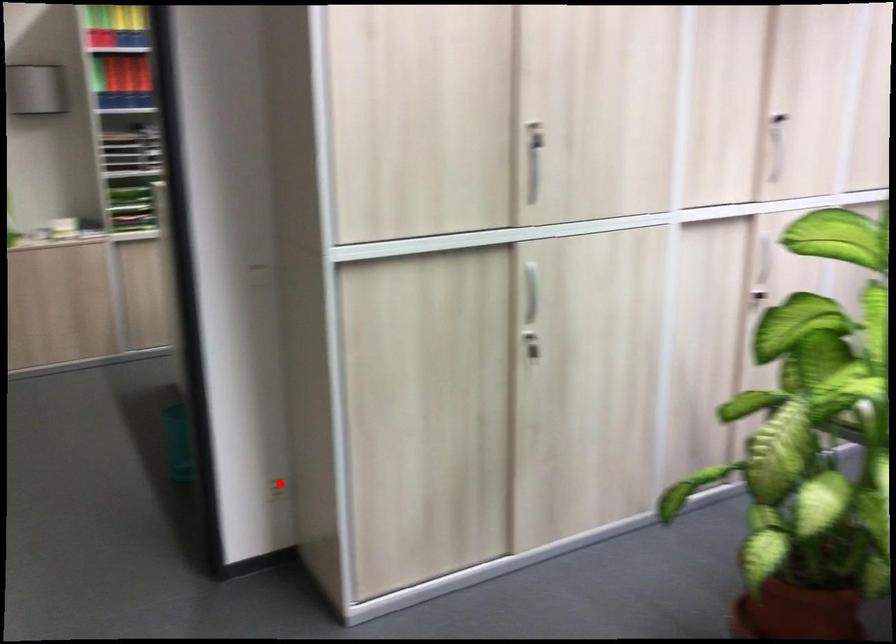
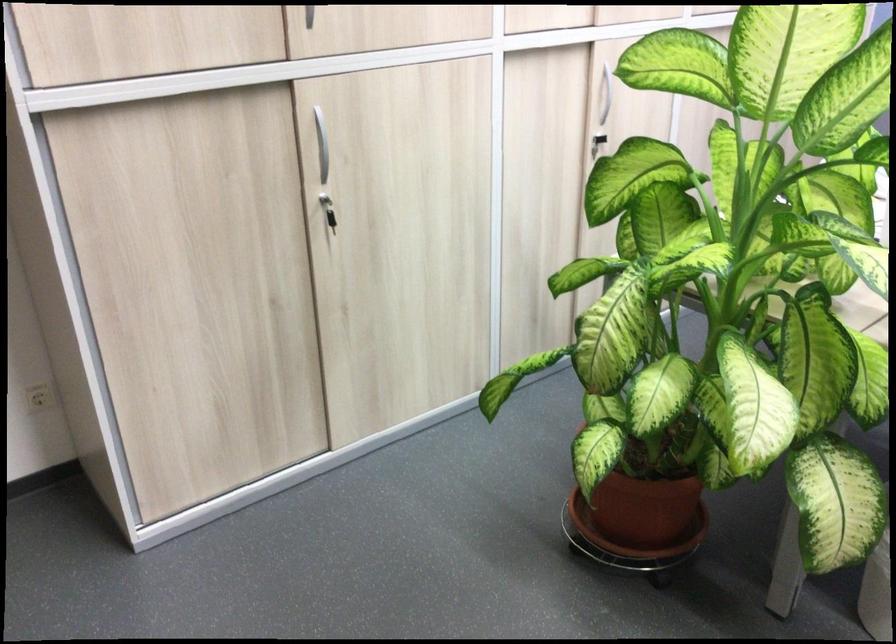
Find the pixel in the second image that matches the highlighted location in the first image.

(39, 397)